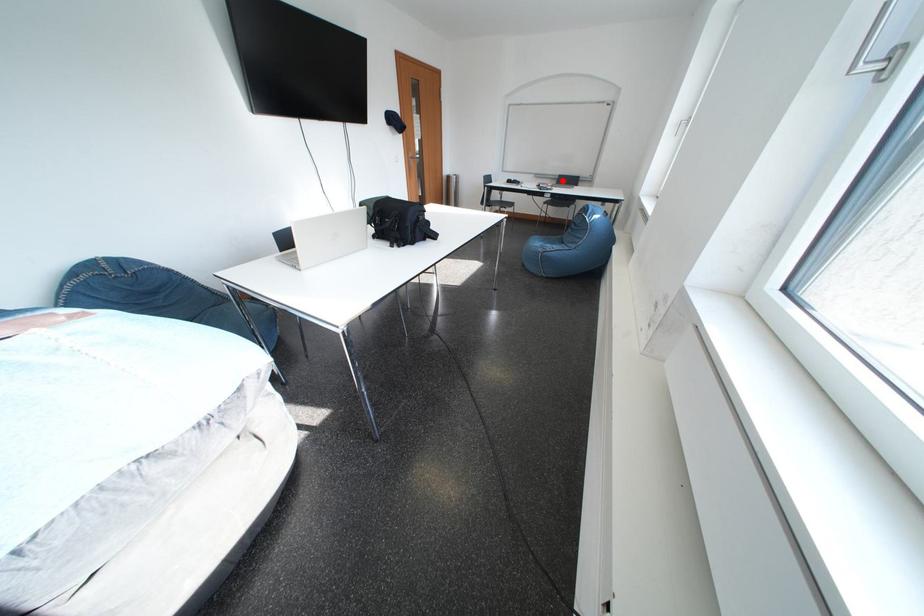
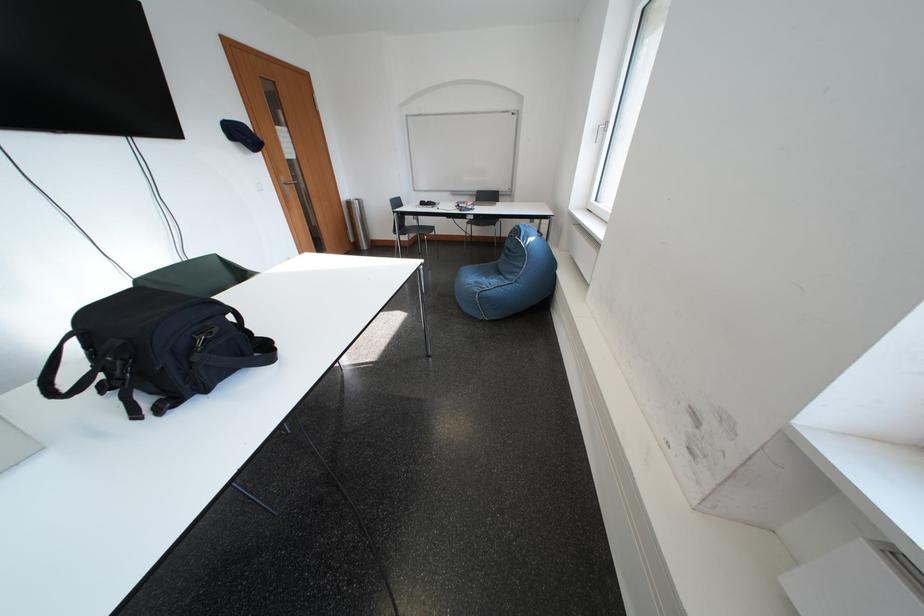
Question: I am providing you with two images of the same scene from different viewpoints. Image1 has a red point marked. In image2, the corresponding 3D location appears at what relative position? Reply with the corresponding letter.

Choices:
 (A) Closer
 (B) Farther

Answer: (B)